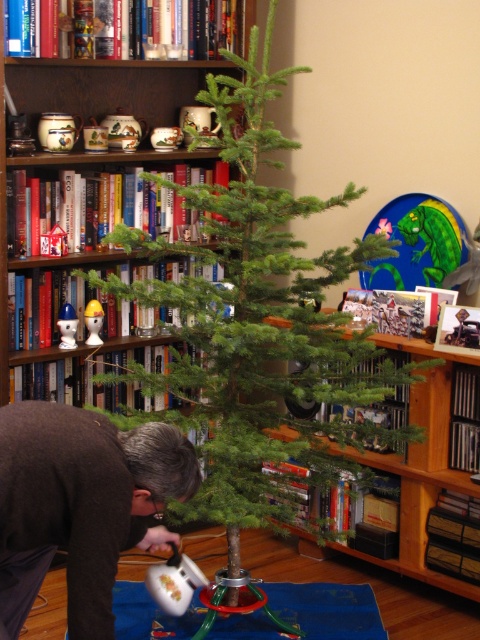
Question: Which is farther from the wooden bookshelf at center?

Choices:
 (A) matte white plastic toy at center
 (B) green matte christmas tree at center
 (C) brown wool sweater at lower left

Answer: (A)

Question: Is green matte christmas tree at center further to the viewer compared to wooden bookshelf at center?

Choices:
 (A) no
 (B) yes

Answer: (A)

Question: Can you confirm if brown wool sweater at lower left is wider than wooden bookshelf at center?

Choices:
 (A) yes
 (B) no

Answer: (B)

Question: Which object appears farthest from the camera in this image?

Choices:
 (A) matte white ceramic toy at center
 (B) wooden bookshelf at center
 (C) brown wool sweater at lower left
 (D) matte white plastic toy at center

Answer: (D)

Question: Which object is farther from the camera taking this photo?

Choices:
 (A) matte white ceramic toy at center
 (B) matte white plastic toy at center

Answer: (B)

Question: Does brown wool sweater at lower left have a smaller size compared to wooden bookshelf at center?

Choices:
 (A) yes
 (B) no

Answer: (A)